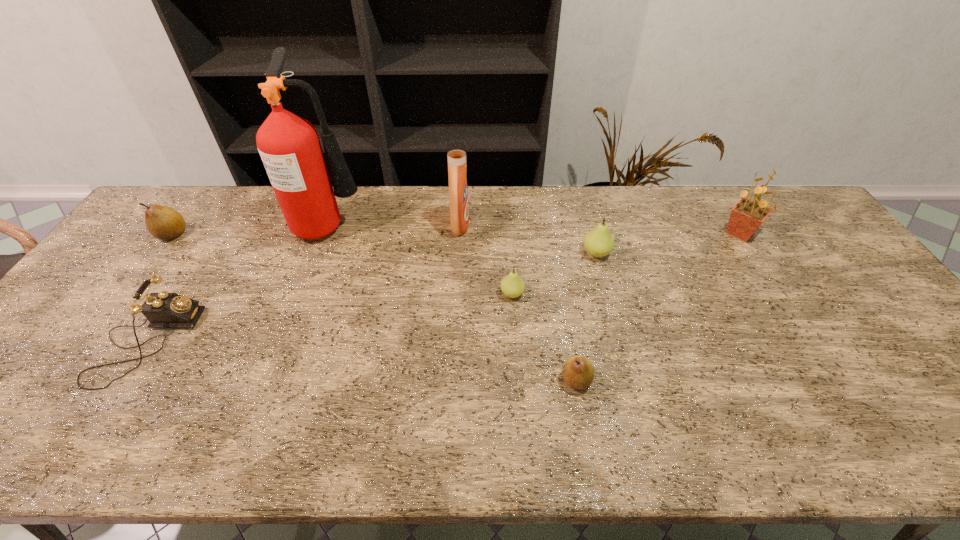
Image resolution: width=960 pixels, height=540 pixels. Find the location of `vacant region that satisfies the following two spatial constraints: 1. on the front-facing side of the seventh object from left to right; 2. on the right side of the seventh shortest object`. vacant region that satisfies the following two spatial constraints: 1. on the front-facing side of the seventh object from left to right; 2. on the right side of the seventh shortest object is located at coordinates (458, 253).

This screenshot has height=540, width=960. Identify the location of vacant space that satisfies the following two spatial constraints: 1. on the front-facing side of the fourth object from left to right; 2. on the left side of the right green pear. (458, 253).

What are the coordinates of `vacant point that satisfies the following two spatial constraints: 1. on the front side of the bigger brown pear; 2. on the right side of the smaller brown pear` in the screenshot? It's located at click(x=65, y=380).

This screenshot has width=960, height=540. What are the coordinates of `free location that satisfies the following two spatial constraints: 1. on the front-facing side of the detergent; 2. on the back side of the third object from right to left` in the screenshot? It's located at (452, 380).